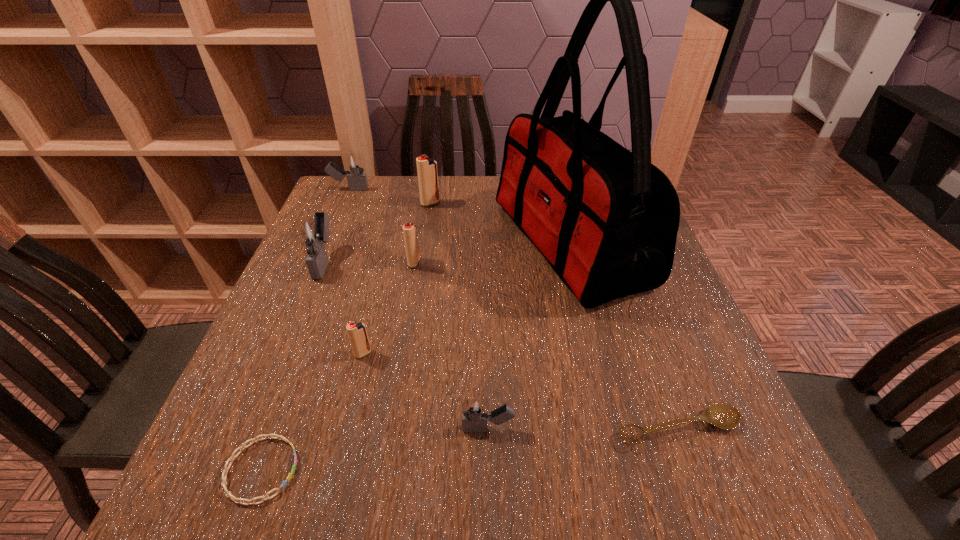
In order to click on the nearest gray igniter in this screenshot , I will do (x=475, y=414).

This screenshot has height=540, width=960. What are the coordinates of `the smallest gray igniter` in the screenshot? It's located at (475, 414).

At what (x,y) coordinates should I click in order to perform the action: click on ladle. Please return your answer as a coordinate pair (x, y). Looking at the image, I should click on point(724,416).

The image size is (960, 540). In order to click on the shortest object in this screenshot , I will do `click(237, 500)`.

Where is `blue bracelet`? blue bracelet is located at coordinates (237, 500).

Image resolution: width=960 pixels, height=540 pixels. In order to click on vacant position located on the left of the red duffel bag in this screenshot , I will do `click(439, 245)`.

Where is `blank space located 0.220m on the left of the biggest red igniter`? This screenshot has width=960, height=540. blank space located 0.220m on the left of the biggest red igniter is located at coordinates (345, 204).

Locate an element on the screen. Image resolution: width=960 pixels, height=540 pixels. free space located on the right of the second nearest gray igniter is located at coordinates (436, 261).

Find the location of `vacant space located on the front of the farthest igniter`. vacant space located on the front of the farthest igniter is located at coordinates (325, 245).

Where is `vacant position located 0.120m on the left of the second smallest red igniter`? vacant position located 0.120m on the left of the second smallest red igniter is located at coordinates (359, 263).